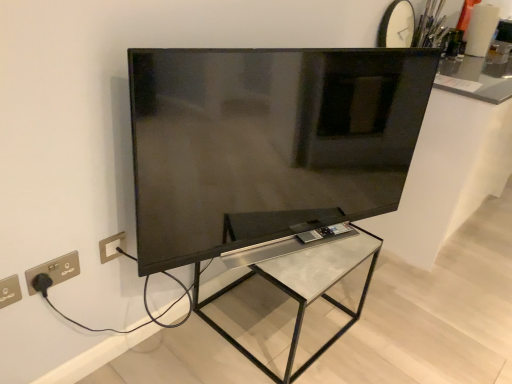
In order to click on matte black tv at center in this screenshot , I will do `click(267, 142)`.

Describe the element at coordinates (267, 142) in the screenshot. The width and height of the screenshot is (512, 384). I see `matte black tv at center` at that location.

Locate an element on the screen. The image size is (512, 384). white glossy countertop at upper right is located at coordinates [x=452, y=160].

Is matte black tv at center not inside gold metallic socket at lower left?

That's correct, matte black tv at center is outside of gold metallic socket at lower left.

Relative to gold metallic socket at lower left, is matte black tv at center in front or behind?

In the image, matte black tv at center appears in front of gold metallic socket at lower left.

Between matte black tv at center and gold metallic socket at lower left, which one has more height?

matte black tv at center is taller.

From a real-world perspective, which object rests below the other?

gold metallic socket at lower left is physically lower.

Which object is positioned more to the left, silver metallic electric outlet at lower left or gold metallic socket at lower left?

Positioned to the left is silver metallic electric outlet at lower left.

Is silver metallic electric outlet at lower left in front of gold metallic socket at lower left?

Yes, it is in front of gold metallic socket at lower left.

Is silver metallic electric outlet at lower left positioned far away from gold metallic socket at lower left?

No, silver metallic electric outlet at lower left is in close proximity to gold metallic socket at lower left.

Locate an element on the screen. electric outlet above the gold metallic socket at lower left (from a real-world perspective) is located at coordinates (9, 291).

In terms of size, does gold metallic socket at lower left appear bigger or smaller than matte black tv at center?

gold metallic socket at lower left is smaller than matte black tv at center.

Can you confirm if gold metallic socket at lower left is positioned to the left of matte black tv at center?

Yes.

Between gold metallic socket at lower left and matte black tv at center, which one is positioned in front?

matte black tv at center is closer to the camera.

The height and width of the screenshot is (384, 512). Find the location of `television located above the gold metallic socket at lower left (from a real-world perspective)`. television located above the gold metallic socket at lower left (from a real-world perspective) is located at coordinates (267, 142).

From a real-world perspective, is white glossy countertop at upper right on silver metallic electric outlet at lower left?

No, from a real-world perspective, white glossy countertop at upper right is not over silver metallic electric outlet at lower left

From the image's perspective, which is above, white glossy countertop at upper right or silver metallic electric outlet at lower left?

white glossy countertop at upper right is shown above in the image.

Is white glossy countertop at upper right wider than silver metallic electric outlet at lower left?

Yes.

Does white glossy countertop at upper right have a larger size compared to silver metallic electric outlet at lower left?

Yes, white glossy countertop at upper right is bigger than silver metallic electric outlet at lower left.

How different are the orientations of gold metallic socket at lower left and silver metallic electric outlet at lower left in degrees?

The facing directions of gold metallic socket at lower left and silver metallic electric outlet at lower left are 0.383 degrees apart.

Which is further, [65,257] or [4,291]?

Positioned behind is point [65,257].

From a real-world perspective, between gold metallic socket at lower left and silver metallic electric outlet at lower left, who is vertically higher?

In real-world perspective, silver metallic electric outlet at lower left is above.

Could silver metallic electric outlet at lower left be considered to be inside gold metallic socket at lower left?

That's incorrect, silver metallic electric outlet at lower left is not inside gold metallic socket at lower left.

Does matte black tv at center have a greater height compared to white glossy countertop at upper right?

In fact, matte black tv at center may be shorter than white glossy countertop at upper right.

Based on the photo, considering the sizes of objects matte black tv at center and white glossy countertop at upper right in the image provided, who is smaller, matte black tv at center or white glossy countertop at upper right?

matte black tv at center is smaller.

Which object is wider, matte black tv at center or white glossy countertop at upper right?

white glossy countertop at upper right is wider.

Can you confirm if silver metallic electric outlet at lower left is smaller than matte black tv at center?

Correct, silver metallic electric outlet at lower left occupies less space than matte black tv at center.

Is silver metallic electric outlet at lower left far from matte black tv at center?

No, there isn't a large distance between silver metallic electric outlet at lower left and matte black tv at center.

Does silver metallic electric outlet at lower left have a greater height compared to matte black tv at center?

No.

Is silver metallic electric outlet at lower left aimed at matte black tv at center?

No.

Find the location of a particular element. The height and width of the screenshot is (384, 512). power plugs and sockets beneath the matte black tv at center (from a real-world perspective) is located at coordinates (55, 270).

Where is `electric outlet in front of the gold metallic socket at lower left`? Image resolution: width=512 pixels, height=384 pixels. electric outlet in front of the gold metallic socket at lower left is located at coordinates (9, 291).

Estimate the real-world distances between objects in this image. Which object is closer to white glossy countertop at upper right, matte black tv at center or silver metallic electric outlet at lower left?

The object closer to white glossy countertop at upper right is matte black tv at center.

Based on their spatial positions, is silver metallic electric outlet at lower left or metallic glass table at center closer to white glossy countertop at upper right?

Among the two, metallic glass table at center is located nearer to white glossy countertop at upper right.

Based on their spatial positions, is metallic glass table at center or silver metallic electric outlet at lower left further from white glossy countertop at upper right?

The object further to white glossy countertop at upper right is silver metallic electric outlet at lower left.

Which object lies nearer to the anchor point matte black tv at center, silver metallic electric outlet at lower left or white glossy countertop at upper right?

Based on the image, white glossy countertop at upper right appears to be nearer to matte black tv at center.

Which object lies further to the anchor point silver metallic electric outlet at lower left, metallic glass table at center or matte black tv at center?

The object further to silver metallic electric outlet at lower left is metallic glass table at center.

Based on their spatial positions, is gold metallic socket at lower left or matte black tv at center closer to silver metallic electric outlet at lower left?

gold metallic socket at lower left.

When comparing their distances from matte black tv at center, does gold metallic socket at lower left or white glossy countertop at upper right seem further?

Based on the image, gold metallic socket at lower left appears to be further to matte black tv at center.

Looking at the image, which one is located further to metallic glass table at center, gold metallic socket at lower left or silver metallic electric outlet at lower left?

Among the two, silver metallic electric outlet at lower left is located further to metallic glass table at center.

Where is `television situated between silver metallic electric outlet at lower left and white glossy countertop at upper right from left to right`? The height and width of the screenshot is (384, 512). television situated between silver metallic electric outlet at lower left and white glossy countertop at upper right from left to right is located at coordinates (267, 142).

The width and height of the screenshot is (512, 384). Identify the location of power plugs and sockets between silver metallic electric outlet at lower left and metallic glass table at center in the horizontal direction. (55, 270).

You are a GUI agent. You are given a task and a screenshot of the screen. Output one action in this format:
    pyautogui.click(x=<x>, y=<y>)
    Task: Click on the furniture located between gold metallic socket at lower left and matte black tv at center in the left-right direction
    
    Given the screenshot: What is the action you would take?
    pyautogui.click(x=305, y=288)

The height and width of the screenshot is (384, 512). I want to click on furniture situated between gold metallic socket at lower left and white glossy countertop at upper right from left to right, so 305,288.